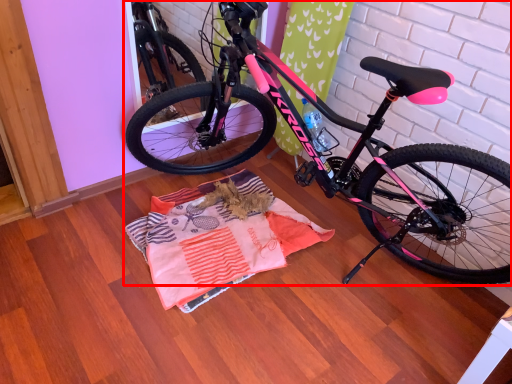
Question: In this image, where is bicycle (annotated by the red box) located relative to blanket?

Choices:
 (A) left
 (B) right

Answer: (B)